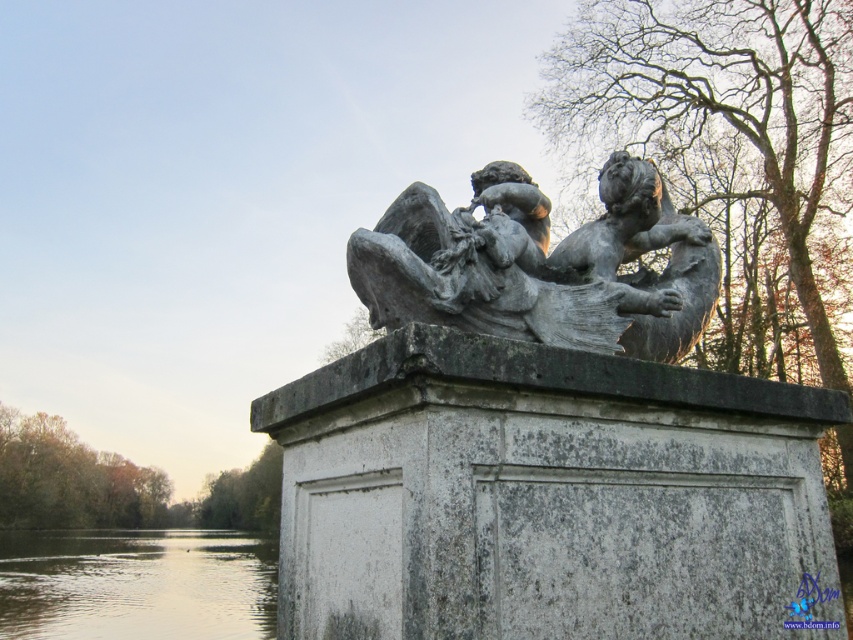
You are an artist planning to paint this scene. You want to ensure the gray stone cherubim at center and the smooth water at lower left are proportionally accurate. Which object should you make wider in your painting to maintain the correct proportions?

The smooth water at lower left should be made wider in the painting since the gray stone cherubim at center has a lesser width compared to smooth water at lower left according to the description.

You are an art conservator examining the sculpture on the stone pedestal. You notice a specific point marked at coordinates (541, 264). What object is located at this point?

The point at coordinates (541, 264) indicates the gray stone cherubim at center.